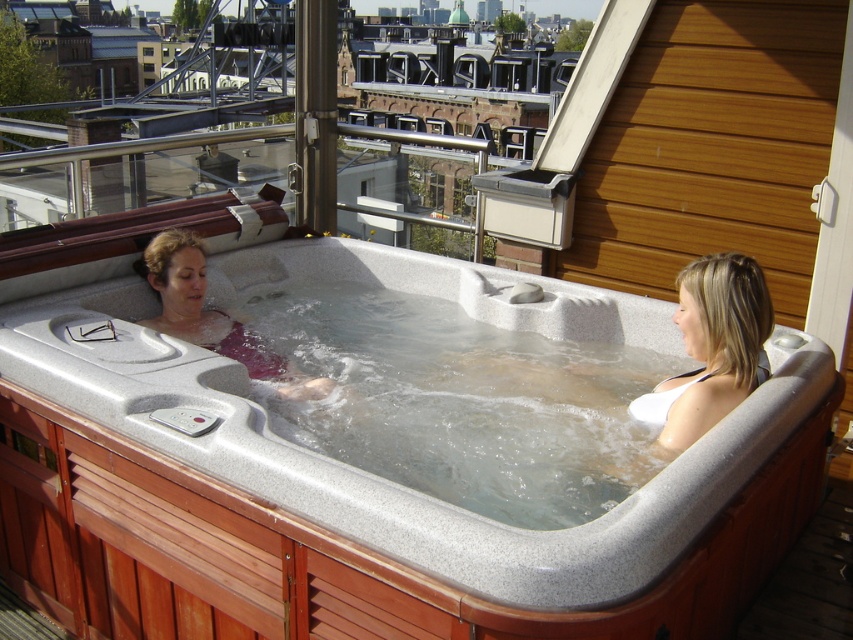
What do you see at coordinates (355, 508) in the screenshot? I see `smooth gray hot tub at center` at bounding box center [355, 508].

Does point (660, 305) come behind point (212, 314)?

No, (660, 305) is closer to viewer.

Does point (177, 385) lie behind point (315, 378)?

No, it is not.

This screenshot has height=640, width=853. What are the coordinates of `smooth gray hot tub at center` in the screenshot? It's located at (355, 508).

Is point (492, 317) closer to viewer compared to point (633, 417)?

That is False.

The height and width of the screenshot is (640, 853). Identify the location of smooth gray hot tub at center. (355, 508).

Is point (202, 522) less distant than point (693, 426)?

Yes, it is.

This screenshot has height=640, width=853. I want to click on smooth gray hot tub at center, so click(x=355, y=508).

Does white matte bikini at upper right appear over matte pink fabric at center?

No.

This screenshot has height=640, width=853. What do you see at coordinates (711, 349) in the screenshot? I see `white matte bikini at upper right` at bounding box center [711, 349].

Find the location of a particular element. white matte bikini at upper right is located at coordinates (711, 349).